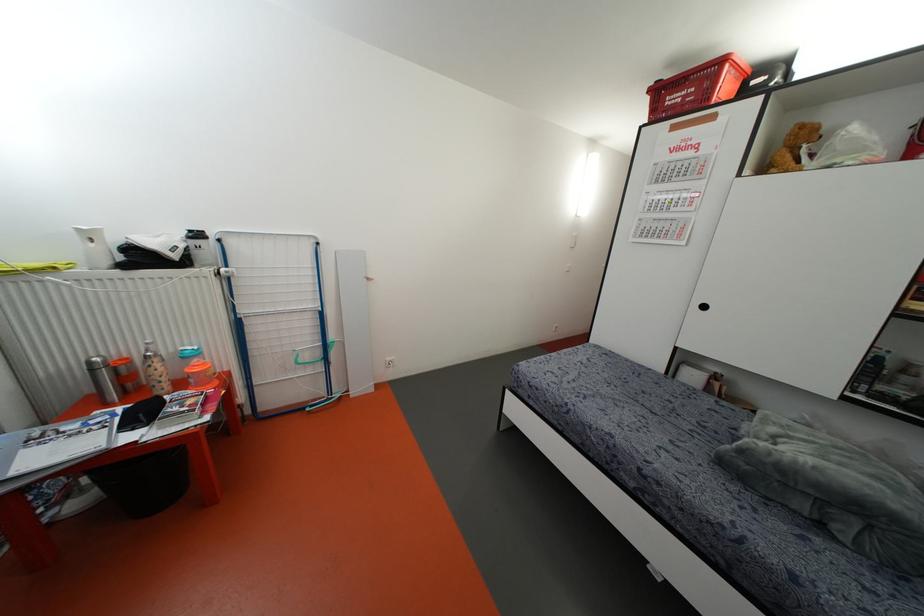
This screenshot has width=924, height=616. I want to click on silver thermos bottle, so click(x=103, y=379).